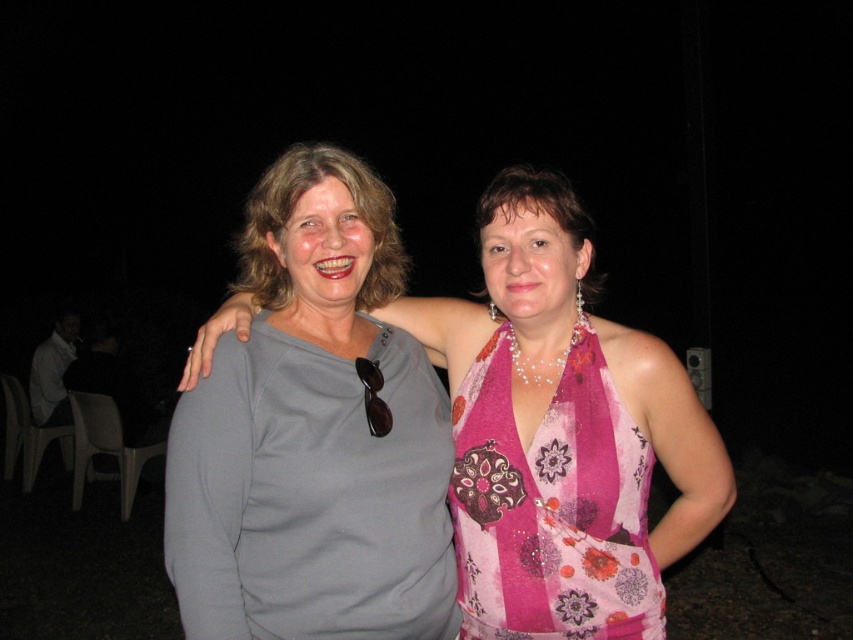
Looking at this image, you are a photographer trying to capture both the matte gray shirt at center and the pink floral fabric dress at center in a single frame. Based on their widths, which one should you focus on to ensure both fit comfortably in the photo?

The matte gray shirt at center might be wider than the pink floral fabric dress at center, so focusing on the wider matte gray shirt at center would help ensure both subjects fit comfortably in the photo.

Based on the scene description, where is the matte gray shirt at center located in terms of its 2D coordinates?

The matte gray shirt at center is located at the 2D coordinates of point (314, 435).